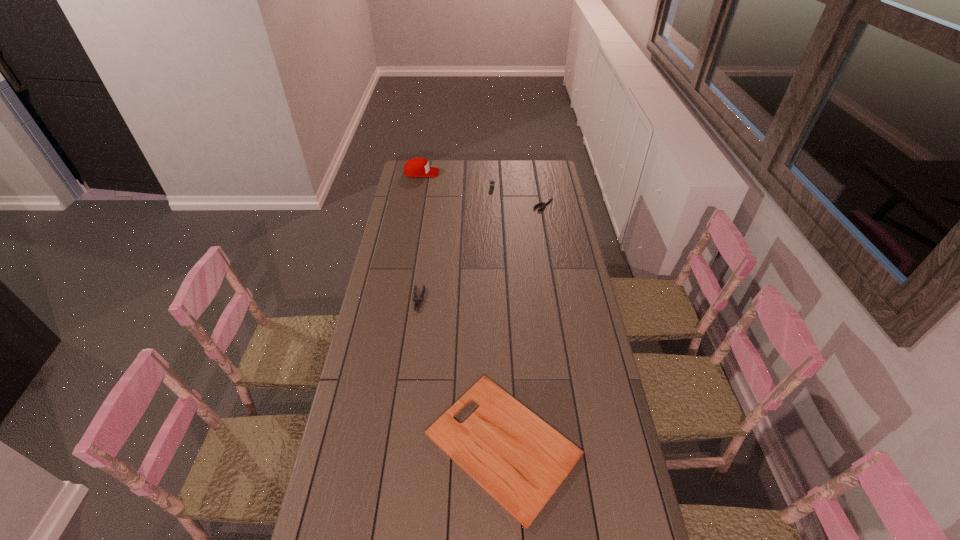
Identify the location of the farthest object. The image size is (960, 540). (416, 167).

Identify the location of baseball cap. The image size is (960, 540). (416, 167).

Identify the location of beer can. (492, 183).

You are a GUI agent. You are given a task and a screenshot of the screen. Output one action in this format:
    pyautogui.click(x=<x>, y=<y>)
    Task: Click on the second farthest object
    This screenshot has width=960, height=540.
    Given the screenshot: What is the action you would take?
    pyautogui.click(x=492, y=183)

Where is `the second nearest object`? The width and height of the screenshot is (960, 540). the second nearest object is located at coordinates click(417, 302).

Where is `the left pliers`? This screenshot has height=540, width=960. the left pliers is located at coordinates (417, 302).

You are a GUI agent. You are given a task and a screenshot of the screen. Output one action in this format:
    pyautogui.click(x=<x>, y=<y>)
    Task: Click on the chopping board
    The width and height of the screenshot is (960, 540).
    Given the screenshot: What is the action you would take?
    pyautogui.click(x=517, y=458)

Identify the location of the shorter pliers. (548, 200).

This screenshot has width=960, height=540. What are the coordinates of `the right pliers` in the screenshot? It's located at (548, 200).

Where is `free region located 0.060m on the front-facing side of the farthest object`? The height and width of the screenshot is (540, 960). free region located 0.060m on the front-facing side of the farthest object is located at coordinates (449, 173).